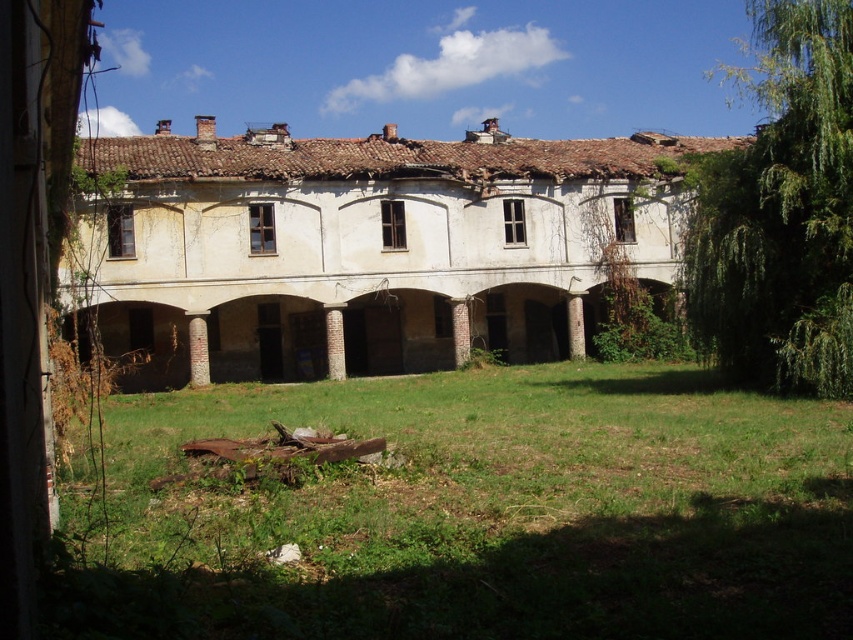
You are standing in front of the abandoned building and see the brown stone column at center and the red brick pillar at center. Which one is positioned more to the left side?

The brown stone column at center is positioned more to the left side because it is to the left of the red brick pillar at center.